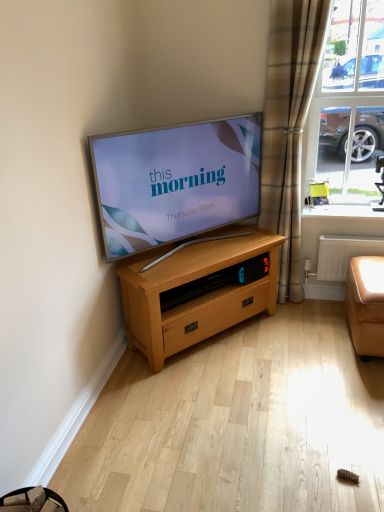
Where is `free space between light oak wooden chest of drawers at center and plaid fabric curtain at right`? The height and width of the screenshot is (512, 384). free space between light oak wooden chest of drawers at center and plaid fabric curtain at right is located at coordinates (272, 324).